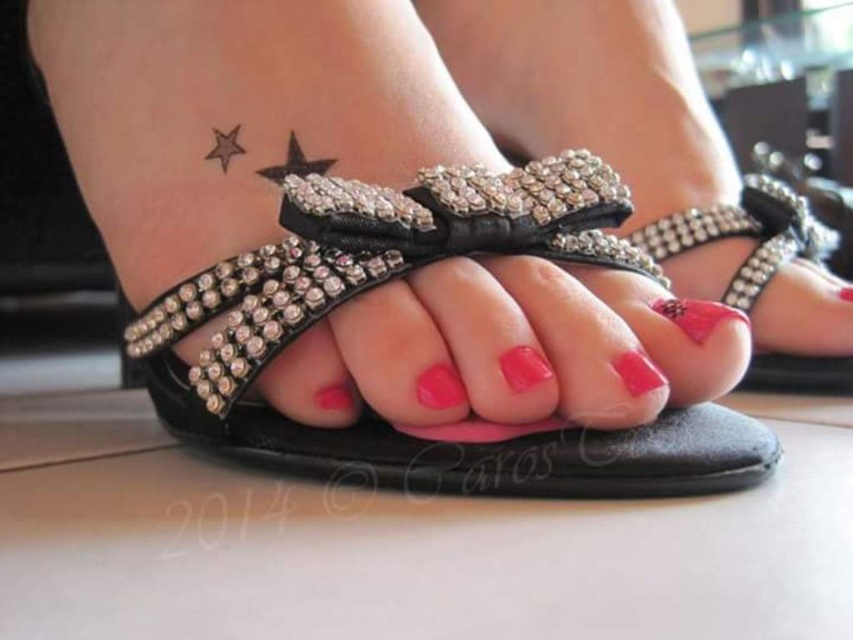
Is black leather sandal at center smaller than matte black sandals at center?

Indeed, black leather sandal at center has a smaller size compared to matte black sandals at center.

Between black leather sandal at center and matte black sandals at center, which one is positioned lower?

black leather sandal at center is below.

Does point (560, 493) come behind point (724, 218)?

No, (560, 493) is closer to viewer.

I want to click on black leather sandal at center, so click(x=397, y=276).

Who is lower down, matte black sandals at center or glossy pink nail at center?

glossy pink nail at center is lower down.

Does matte black sandals at center appear under glossy pink nail at center?

No.

Describe the element at coordinates (646, 148) in the screenshot. The width and height of the screenshot is (853, 640). I see `matte black sandals at center` at that location.

This screenshot has width=853, height=640. Find the location of `matte black sandals at center`. matte black sandals at center is located at coordinates (646, 148).

How far apart are pink glossy nail at center and glossy pink nail at center?

1.75 inches

Which of these two, pink glossy nail at center or glossy pink nail at center, stands taller?

glossy pink nail at center

Identify the location of pink glossy nail at center. Image resolution: width=853 pixels, height=640 pixels. coord(439,387).